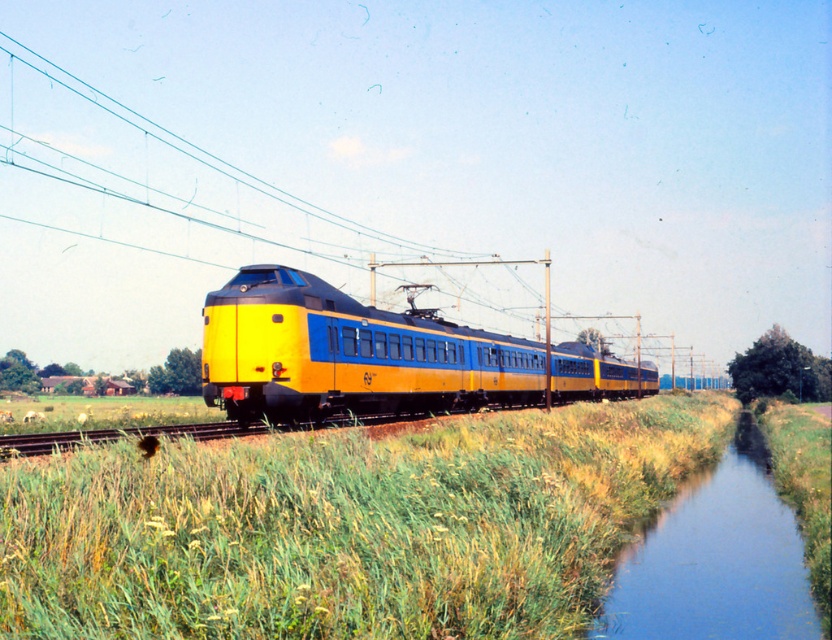
Does green grassy at center lie in front of blue smooth water at lower right?

Yes, it is in front of blue smooth water at lower right.

The height and width of the screenshot is (640, 832). Describe the element at coordinates (345, 525) in the screenshot. I see `green grassy at center` at that location.

Locate an element on the screen. This screenshot has height=640, width=832. green grassy at center is located at coordinates (345, 525).

Does yellow matte train at center appear on the left side of blue smooth water at lower right?

No, yellow matte train at center is not to the left of blue smooth water at lower right.

Can you confirm if yellow matte train at center is positioned to the right of blue smooth water at lower right?

Correct, you'll find yellow matte train at center to the right of blue smooth water at lower right.

Between point (402, 362) and point (722, 634), which one is positioned behind?

The point (402, 362) is behind.

What are the coordinates of `yellow matte train at center` in the screenshot? It's located at (377, 356).

Identify the location of green grassy at center. (345, 525).

Can you confirm if green grassy at center is thinner than yellow matte train at center?

Indeed, green grassy at center has a lesser width compared to yellow matte train at center.

Is point (558, 593) closer to viewer compared to point (245, 374)?

Yes, it is in front of point (245, 374).

This screenshot has height=640, width=832. Identify the location of green grassy at center. (345, 525).